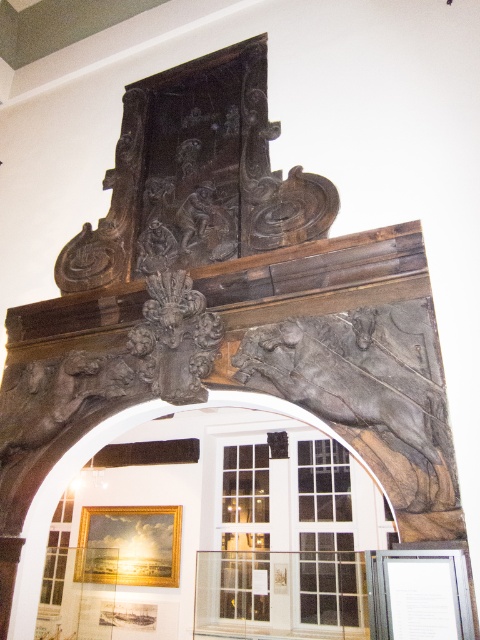
You are an architect examining the structure. You need to determine the spatial relationship between the dark gray stone horse at center and the dark stone archway at center. Which one is positioned higher in the image?

The dark gray stone horse at center is positioned above the dark stone archway at center, so it is higher in the image.

You are an architect designing a new museum exhibit and need to place a 2.5 meter wide sculpture between the dark gray stone horse at center and the dark stone archway at center. Can the sculpture fit in the space between them?

The dark gray stone horse at center is narrower than the dark stone archway at center. Since the sculpture is 2.5 meters wide, it can fit between them as long as the distance between the two objects is at least 2.5 meters. However, the description only states the width of the horse compared to the archway, not the distance between them. Without knowing the actual spacing, we cannot confirm if the sculpture will fit.

You are an art conservator tasked with installing a protective glass panel over the dark gray stone horse at center and dark stone archway at center. The glass panel must be large enough to cover both objects without overlapping them. What is the minimum width required for the glass panel in inches?

The dark gray stone horse at center is 15.29 inches from the dark stone archway at center. To cover both objects without overlapping, the minimum width of the glass panel should be at least 15.29 inches.